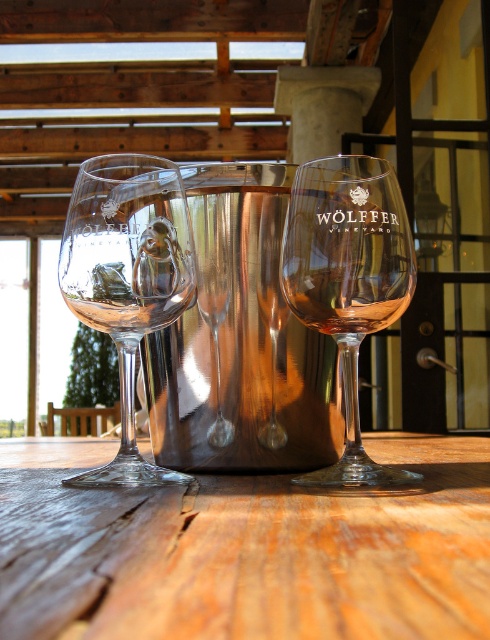
You are holding a small toy that is 20 centimeters long and want to place it on the table where the transparent glass at center is located. Can the toy fit entirely on the table without overlapping the glass?

The transparent glass at center and viewer are 24.02 centimeters apart, so the toy which is 20 centimeters long can fit on the table without overlapping the glass as there is enough space between them.

You are setting up for a small gathering and need to place a decorative centerpiece on the wooden table at center. Considering the size of the clear glass wine glass at left, will the table have enough space to accommodate both the centerpiece and the glass?

The wooden table at center has a larger size compared to the clear glass wine glass at left, so there should be sufficient space to place a decorative centerpiece alongside the glass.

You are at a vineyard and want to pour a drink into the larger glass. Which one should you choose between the transparent glass at center and the clear glass wine at left?

The transparent glass at center is larger in size compared to the clear glass wine at left, so you should choose the transparent glass at center to pour your drink into.